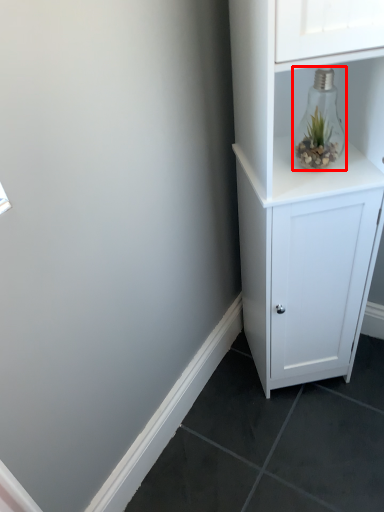
Question: From the image's perspective, where is glass vase (annotated by the red box) located relative to cupboard?

Choices:
 (A) below
 (B) above

Answer: (B)